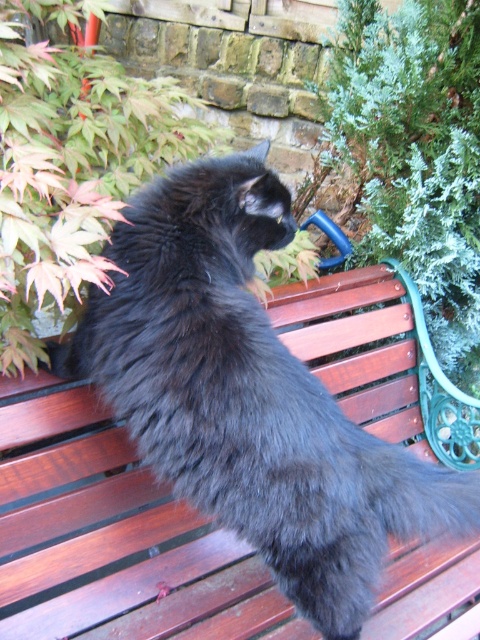
Between green leafy plant at upper left and black fluffy tail at center, which one is positioned higher?

Positioned higher is green leafy plant at upper left.

Between green leafy plant at upper left and black fluffy tail at center, which one appears on the right side from the viewer's perspective?

black fluffy tail at center

The height and width of the screenshot is (640, 480). Identify the location of green leafy plant at upper left. (72, 161).

Which is behind, point (227, 348) or point (381, 456)?

The point (381, 456) is behind.

In order to click on black fluffy cat at center in this screenshot , I will do `click(249, 396)`.

Does black fluffy cat at center appear over green leafy plant at upper left?

Incorrect, black fluffy cat at center is not positioned above green leafy plant at upper left.

Which is below, black fluffy cat at center or green leafy plant at upper left?

black fluffy cat at center is lower down.

You are a GUI agent. You are given a task and a screenshot of the screen. Output one action in this format:
    pyautogui.click(x=<x>, y=<y>)
    Task: Click on the black fluffy cat at center
    Image resolution: width=480 pixels, height=640 pixels.
    Given the screenshot: What is the action you would take?
    pyautogui.click(x=249, y=396)